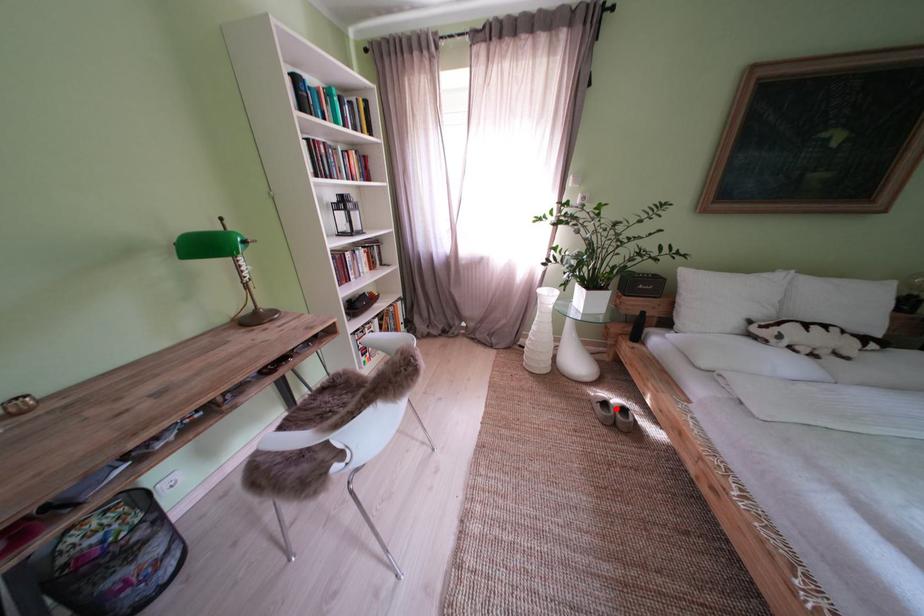
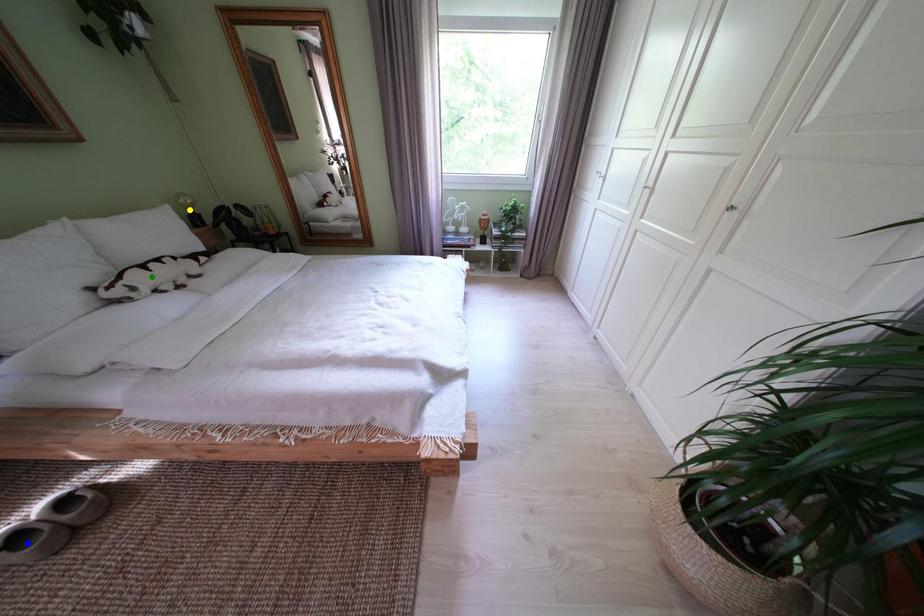
Question: I am providing you with two images of the same scene from different viewpoints. A red point is marked on the first image. You are given multiple points on the second image. Which point in image 2 is actually the same real-world point as the red point in image 1?

Choices:
 (A) green point
 (B) blue point
 (C) yellow point

Answer: (B)